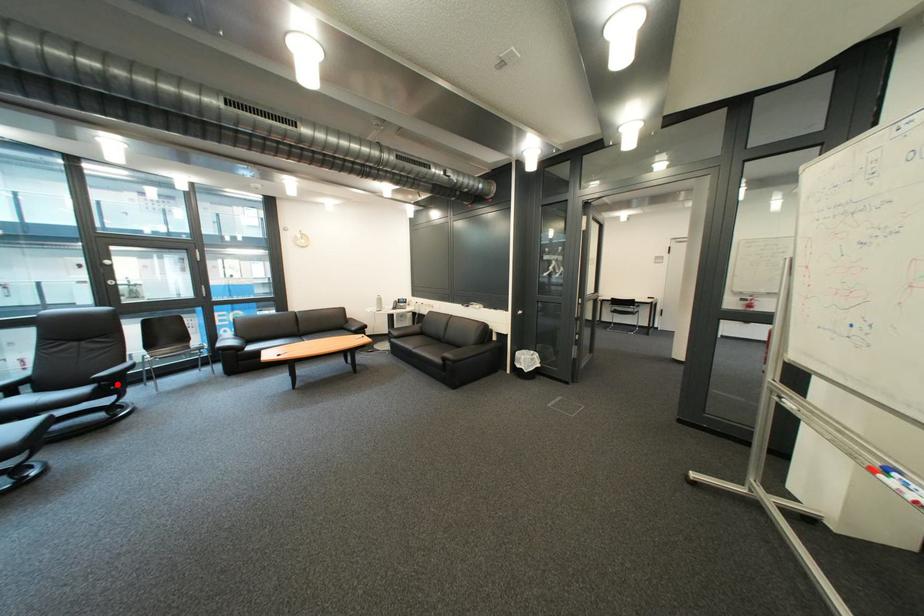
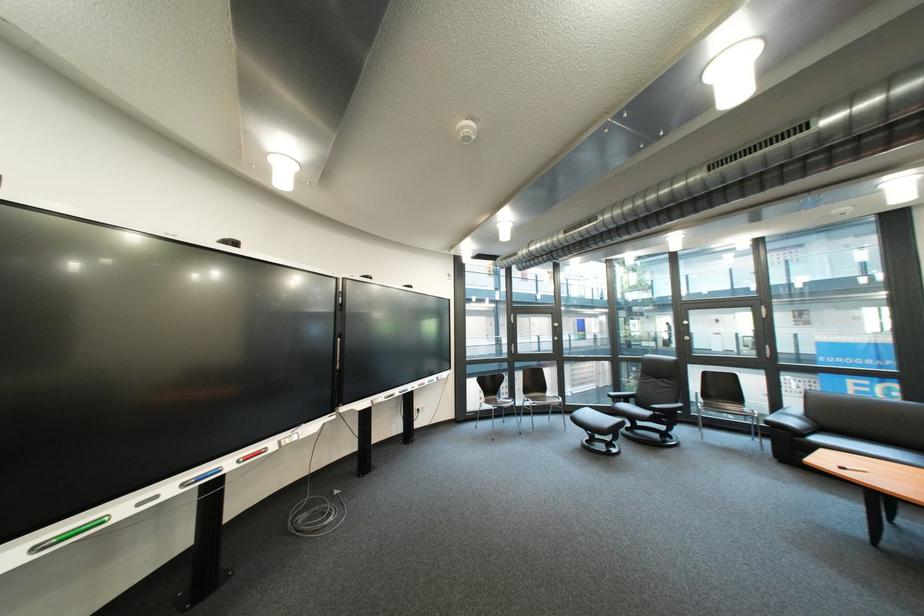
Where in the second image is the point corresponding to the highlighted location from the first image?

(670, 415)